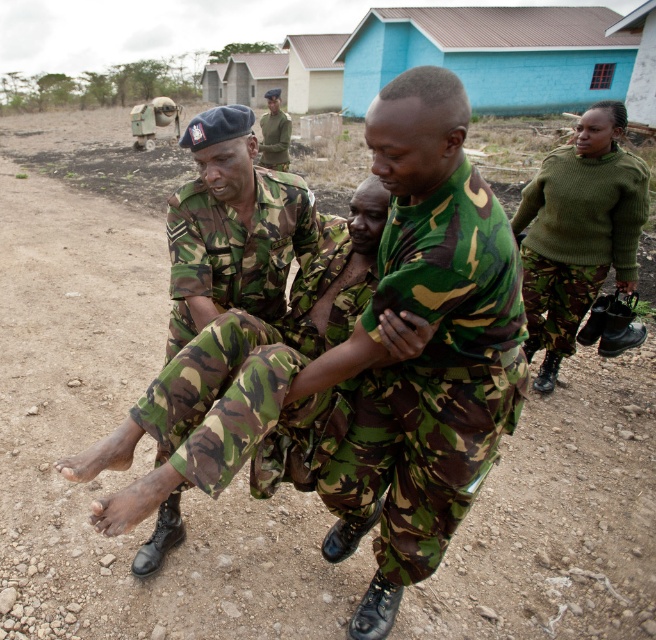
Based on the scene description, where is the camo fabric pants at center located in terms of coordinates?

The camo fabric pants at center is located at point (256, 387).

Based on the scene description, which object is shorter in length between the camo fabric pants at center and the green knitted sweater at right?

The camo fabric pants at center is shorter than the green knitted sweater at right according to the description.

In the scene where two men in camouflage uniforms are assisting an individual seated on the ground, which object takes up more space between the camouflage fabric uniform at center and the camouflage uniform at center?

The camouflage uniform at center occupies more space than the camouflage fabric uniform at center.